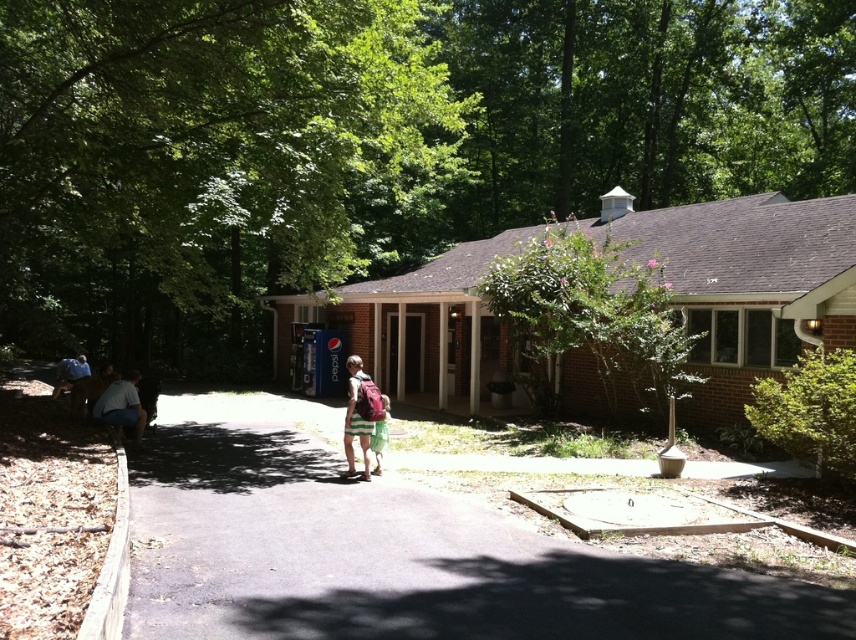
Who is positioned more to the left, striped cotton shorts at center or denim jacket at lower left?

From the viewer's perspective, denim jacket at lower left appears more on the left side.

Can you confirm if striped cotton shorts at center is positioned above denim jacket at lower left?

Incorrect, striped cotton shorts at center is not positioned above denim jacket at lower left.

Find the location of `striped cotton shorts at center`. striped cotton shorts at center is located at coordinates (360, 413).

Is brick gazebo at center to the right of denim shorts at lower left from the viewer's perspective?

Indeed, brick gazebo at center is positioned on the right side of denim shorts at lower left.

Can you confirm if brick gazebo at center is taller than denim shorts at lower left?

Indeed, brick gazebo at center has a greater height compared to denim shorts at lower left.

Who is more distant from viewer, (849, 285) or (103, 420)?

The point (103, 420) is more distant.

Identify the location of brick gazebo at center. (745, 284).

Can you confirm if green leafy tree at center is smaller than striped cotton shorts at center?

Incorrect, green leafy tree at center is not smaller in size than striped cotton shorts at center.

Which of these two, green leafy tree at center or striped cotton shorts at center, stands shorter?

striped cotton shorts at center is shorter.

Is point (437, 42) behind point (369, 420)?

That is True.

Where is `green leafy tree at center`? This screenshot has height=640, width=856. green leafy tree at center is located at coordinates (369, 141).